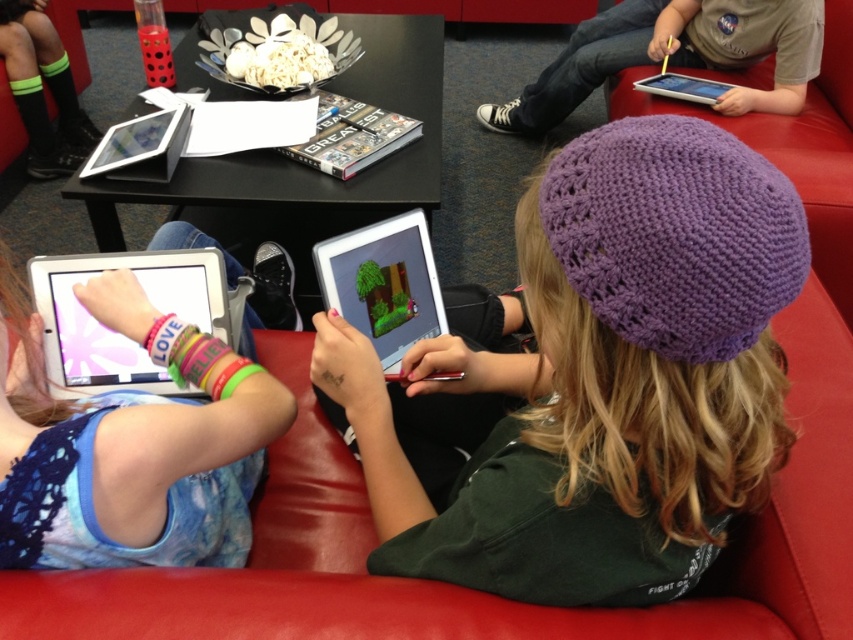
Between purple knitted beanie at center and purple knitted hat at upper center, which one appears on the left side from the viewer's perspective?

purple knitted beanie at center is more to the left.

Between point (404, 566) and point (827, 177), which one is positioned behind?

The point (827, 177) is more distant.

Describe the element at coordinates (596, 376) in the screenshot. I see `purple knitted beanie at center` at that location.

Where is `purple knitted beanie at center`? purple knitted beanie at center is located at coordinates (596, 376).

Is purple knitted hat at upper center closer to camera compared to white glossy tablet at left?

No, purple knitted hat at upper center is further to the viewer.

Between purple knitted hat at upper center and white glossy tablet at left, which one has less height?

white glossy tablet at left is shorter.

Locate an element on the screen. The height and width of the screenshot is (640, 853). purple knitted hat at upper center is located at coordinates (793, 147).

Who is more forward, [701,211] or [74,378]?

Point [701,211] is in front.

Who is more distant from viewer, (712,200) or (146,362)?

Point (146,362)

Describe the element at coordinates (596, 376) in the screenshot. I see `purple knitted beanie at center` at that location.

At what (x,y) coordinates should I click in order to perform the action: click on purple knitted beanie at center. Please return your answer as a coordinate pair (x, y). Looking at the image, I should click on point(596,376).